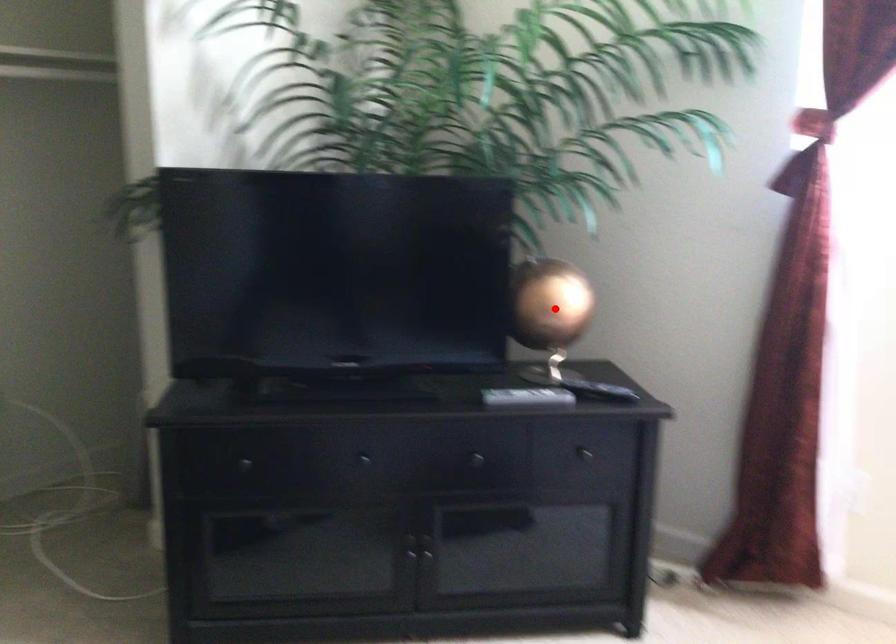
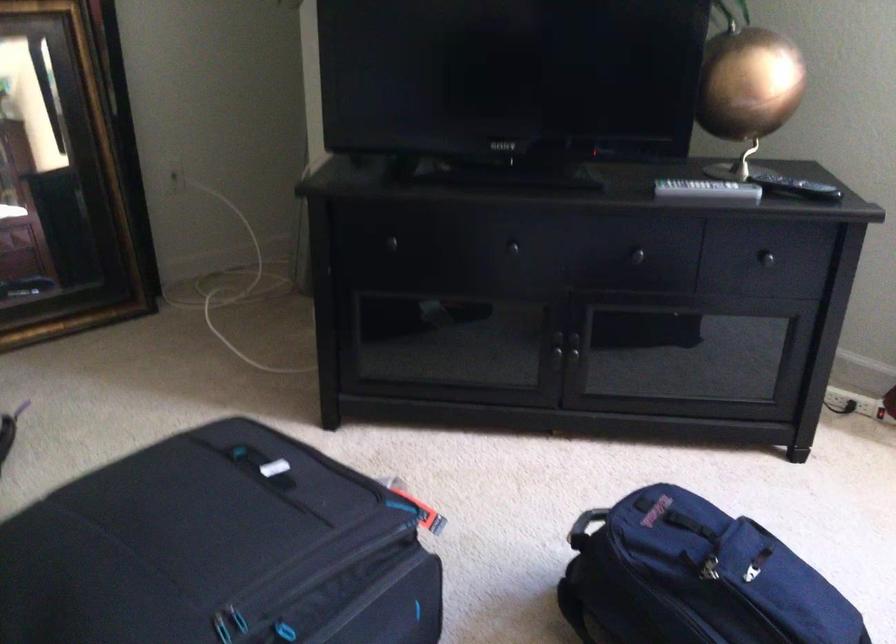
Where in the second image is the point corresponding to the highlighted location from the first image?

(746, 88)